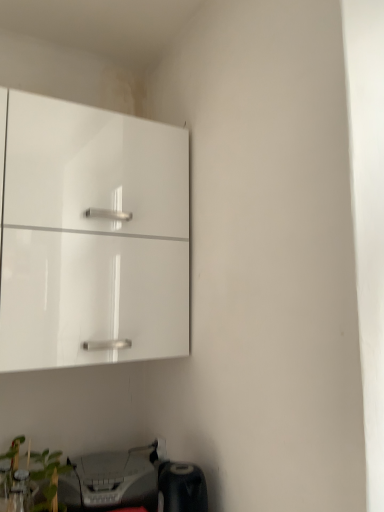
Question: Is green leafy plant at lower left thinner than glossy white cabinet at upper left?

Choices:
 (A) yes
 (B) no

Answer: (A)

Question: Is green leafy plant at lower left to the left of glossy white cabinet at upper left from the viewer's perspective?

Choices:
 (A) yes
 (B) no

Answer: (A)

Question: Is the position of green leafy plant at lower left less distant than that of glossy white cabinet at upper left?

Choices:
 (A) no
 (B) yes

Answer: (A)

Question: Is green leafy plant at lower left taller than glossy white cabinet at upper left?

Choices:
 (A) no
 (B) yes

Answer: (A)

Question: Does green leafy plant at lower left contain glossy white cabinet at upper left?

Choices:
 (A) yes
 (B) no

Answer: (B)

Question: From a real-world perspective, is green leafy plant at lower left physically below glossy white cabinet at upper left?

Choices:
 (A) yes
 (B) no

Answer: (A)

Question: Is matte gray printer at lower left wider than glossy white cabinet at upper left?

Choices:
 (A) no
 (B) yes

Answer: (A)

Question: Is matte gray printer at lower left thinner than glossy white cabinet at upper left?

Choices:
 (A) yes
 (B) no

Answer: (A)

Question: Can you confirm if matte gray printer at lower left is taller than glossy white cabinet at upper left?

Choices:
 (A) no
 (B) yes

Answer: (A)

Question: From the image's perspective, is matte gray printer at lower left over glossy white cabinet at upper left?

Choices:
 (A) no
 (B) yes

Answer: (A)

Question: Is matte gray printer at lower left positioned behind glossy white cabinet at upper left?

Choices:
 (A) yes
 (B) no

Answer: (A)

Question: Does matte gray printer at lower left have a lesser height compared to glossy white cabinet at upper left?

Choices:
 (A) yes
 (B) no

Answer: (A)

Question: Considering the relative sizes of matte gray printer at lower left and green leafy plant at lower left in the image provided, is matte gray printer at lower left wider than green leafy plant at lower left?

Choices:
 (A) no
 (B) yes

Answer: (B)